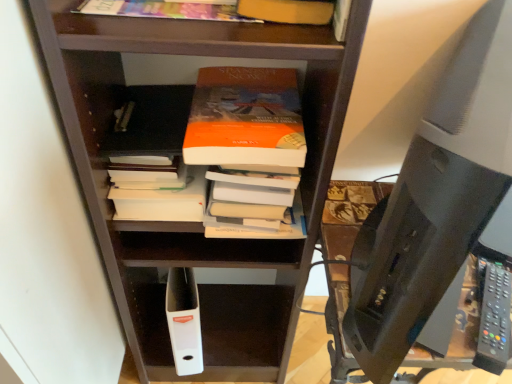
Question: Is point (108, 6) closer or farther from the camera than point (207, 301)?

Choices:
 (A) closer
 (B) farther

Answer: (A)

Question: From the image's perspective, is multicolored paper at upper center, placed as the 1th book when sorted from top to bottom, located above or below brown wooden shelf at center?

Choices:
 (A) above
 (B) below

Answer: (A)

Question: Which object is positioned closest to the matte orange book at upper center, which appears as the second book when ordered from the bottom?

Choices:
 (A) black plastic desktop computer at right
 (B) white matte book at center, which is the first book in back-to-front order
 (C) brown wooden shelf at center
 (D) multicolored paper at upper center, positioned as the third book in bottom-to-top order
 (E) black plastic remote at lower right

Answer: (D)

Question: Estimate the real-world distances between objects in this image. Which object is closer to the brown wooden shelf at center?

Choices:
 (A) matte orange book at upper center, the second book positioned from the top
 (B) black plastic desktop computer at right
 (C) white matte book at center, which is the 3th book in front-to-back order
 (D) multicolored paper at upper center, the first book when ordered from front to back
 (E) black plastic remote at lower right

Answer: (C)